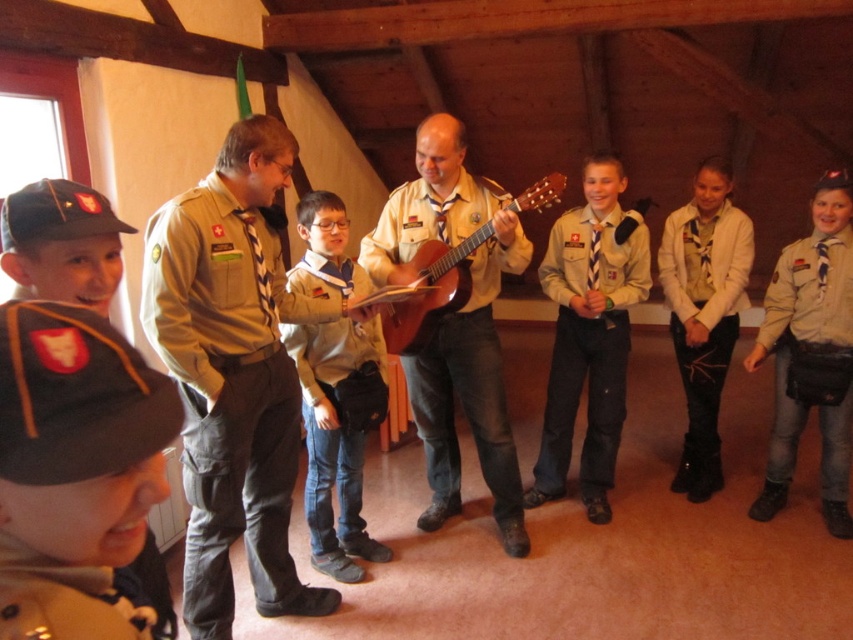
Does khaki uniform cap at lower left come in front of wooden acoustic guitar at center?

Yes.

Between khaki uniform cap at lower left and wooden acoustic guitar at center, which one has less height?

khaki uniform cap at lower left is shorter.

The image size is (853, 640). Identify the location of khaki uniform cap at lower left. (74, 397).

Is brown fabric sash at right above wooden acoustic guitar at center?

No.

Is point (845, 317) in front of point (544, 186)?

No, it is not.

You are a GUI agent. You are given a task and a screenshot of the screen. Output one action in this format:
    pyautogui.click(x=<x>, y=<y>)
    Task: Click on the brown fabric sash at right
    
    Given the screenshot: What is the action you would take?
    point(802,326)

Who is more forward, (196, 426) or (699, 465)?

Positioned in front is point (196, 426).

Does point (200, 598) come closer to viewer compared to point (728, 262)?

That is True.

The width and height of the screenshot is (853, 640). I want to click on khaki uniform at center, so click(x=233, y=372).